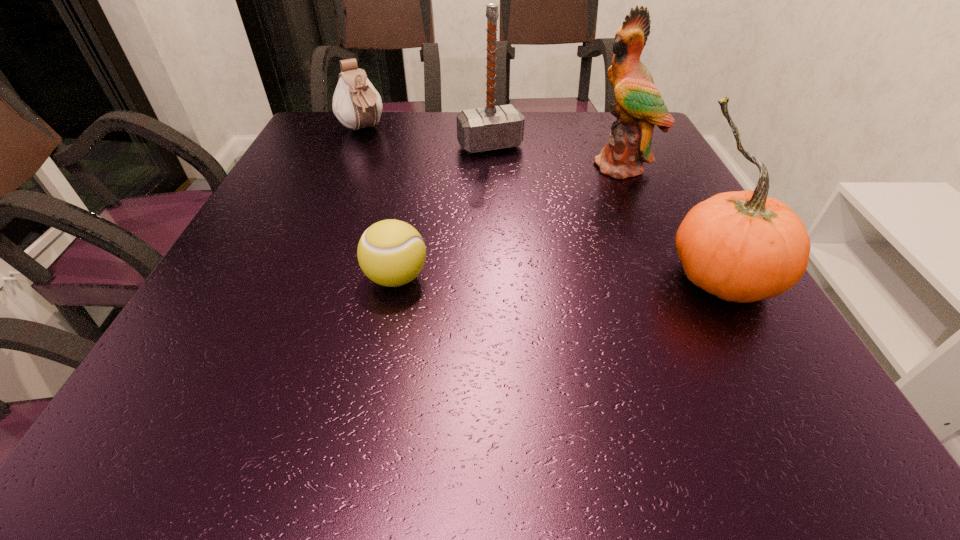
This screenshot has width=960, height=540. What are the coordinates of `vacant space located 0.160m on the striking surface of the hammer` in the screenshot? It's located at (521, 191).

You are a GUI agent. You are given a task and a screenshot of the screen. Output one action in this format:
    pyautogui.click(x=<x>, y=<y>)
    Task: Click on the vacant region located 0.280m on the striking surface of the hammer
    
    Given the screenshot: What is the action you would take?
    pyautogui.click(x=541, y=221)

The width and height of the screenshot is (960, 540). Identify the location of vacant area situated on the front-facing side of the parrot. (586, 200).

At what (x,y) coordinates should I click in order to perform the action: click on vacant space located 0.330m on the front-facing side of the parrot. Please return your answer as a coordinate pair (x, y). The height and width of the screenshot is (540, 960). Looking at the image, I should click on click(x=538, y=249).

Find the location of a particular element. Image resolution: width=960 pixels, height=540 pixels. vacant area situated 0.230m on the front-facing side of the parrot is located at coordinates (563, 225).

I want to click on vacant space located 0.400m on the front-facing side of the pouch, so click(x=445, y=214).

This screenshot has width=960, height=540. In order to click on free location located 0.340m on the front-facing side of the pouch in this screenshot , I will do `click(431, 200)`.

This screenshot has height=540, width=960. What are the coordinates of `blank space located 0.120m on the front-facing side of the pouch` in the screenshot? It's located at (389, 159).

The width and height of the screenshot is (960, 540). In order to click on hammer located in the far edge section of the desktop in this screenshot , I will do pos(493,127).

Locate an element on the screen. parrot situated at the far edge is located at coordinates (638, 107).